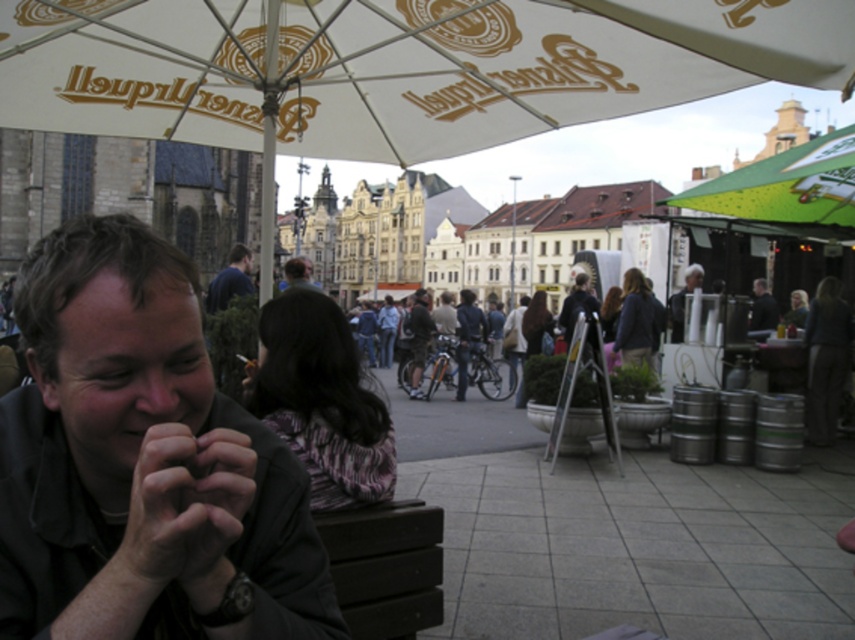
Is dark gray shirt at center to the left of dark skin hand at center from the viewer's perspective?

Yes, dark gray shirt at center is to the left of dark skin hand at center.

Which is more to the left, dark gray shirt at center or dark skin hand at center?

Positioned to the left is dark gray shirt at center.

At what (x,y) coordinates should I click in order to perform the action: click on dark gray shirt at center. Please return your answer as a coordinate pair (x, y). The height and width of the screenshot is (640, 855). Looking at the image, I should click on (142, 461).

Can you confirm if dark skin hand at center is smaller than gray fabric jacket at upper right?

Correct, dark skin hand at center occupies less space than gray fabric jacket at upper right.

Can you confirm if dark skin hand at center is positioned above gray fabric jacket at upper right?

No, dark skin hand at center is not above gray fabric jacket at upper right.

Where is `dark skin hand at center`? This screenshot has height=640, width=855. dark skin hand at center is located at coordinates (184, 509).

The width and height of the screenshot is (855, 640). Describe the element at coordinates (393, 68) in the screenshot. I see `white fabric umbrella at upper center` at that location.

Between white fabric umbrella at upper center and blue shirt at center, which one has less height?

With less height is blue shirt at center.

Between point (688, 56) and point (227, 272), which one is positioned in front?

Point (688, 56) is in front.

In order to click on white fabric umbrella at upper center in this screenshot , I will do `click(393, 68)`.